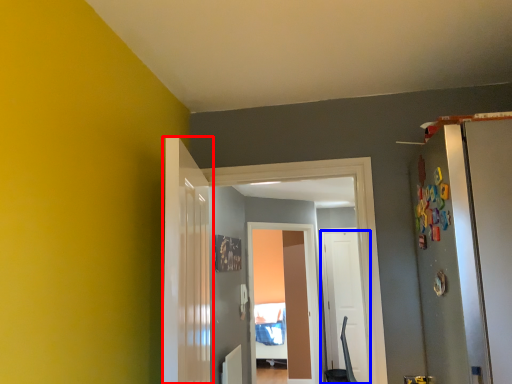
Question: Which object appears farthest to the camera in this image, door (highlighted by a red box) or door (highlighted by a blue box)?

Choices:
 (A) door
 (B) door

Answer: (B)